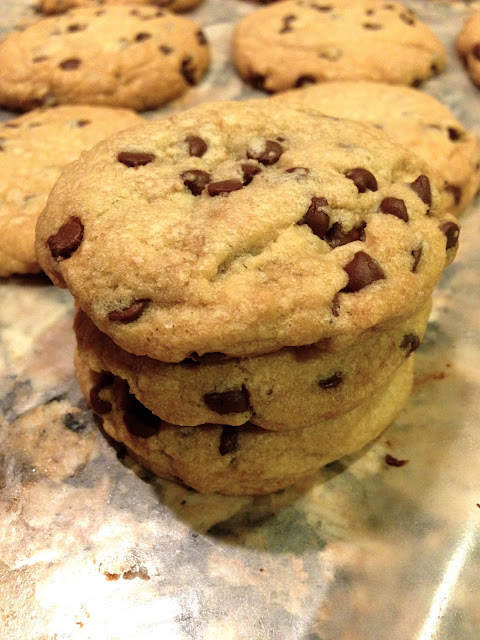
The width and height of the screenshot is (480, 640). Find the location of `brown counter`. brown counter is located at coordinates (281, 589).